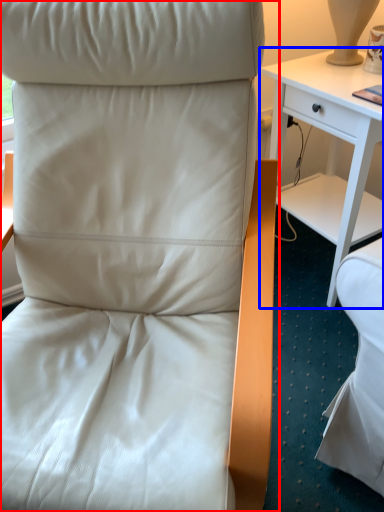
Question: Which of the following is the farthest to the observer, chair (highlighted by a red box) or desk (highlighted by a blue box)?

Choices:
 (A) chair
 (B) desk

Answer: (B)